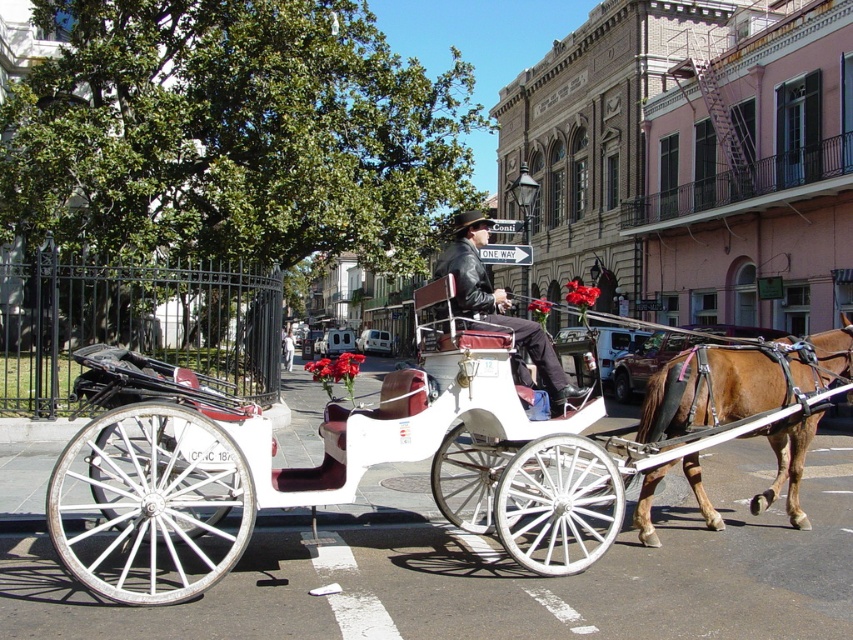
You are a tourist standing on the sidewalk and want to take a photo of the white polished wood cart at center and the brown glossy horse at right. Based on their positions, which one should you focus on first to ensure both are in frame?

The white polished wood cart at center is below the brown glossy horse at right, so you should focus on the horse first to ensure both are in frame.

From the picture: You are standing in the street scene and want to take a photo of the brown glossy horse at right. The camera you are using has a zoom lens that can focus on objects as small as 0.5 meters in width. Based on the coordinates provided, can you determine if the horse is within the camera focus range?

The brown glossy horse at right is located at point (740, 381). Since the camera can focus on objects as small as 0.5 meters in width, the horse is within the focus range as long as its width at that coordinate is at least 0.5 meters. However, the exact width isn

You are a photographer standing in the street scene and want to take a picture of the leather jacket at center. Where should you aim your camera to capture it?

You should aim your camera at the point with coordinates (497, 304) to capture the leather jacket at center.